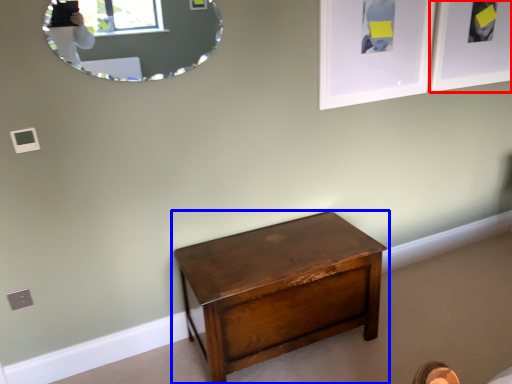
Question: Which of the following is the closest to the observer, picture frame (highlighted by a red box) or nightstand (highlighted by a blue box)?

Choices:
 (A) picture frame
 (B) nightstand

Answer: (B)